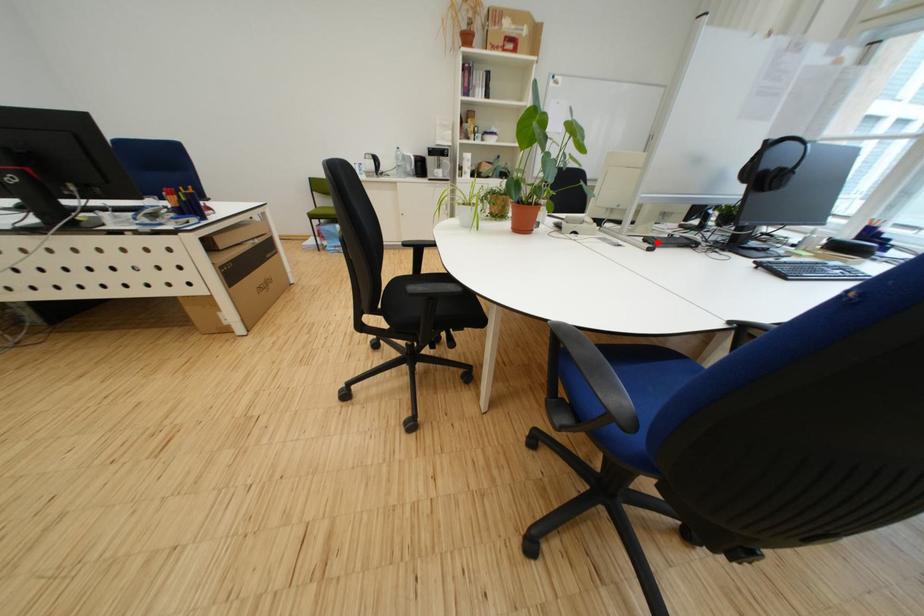
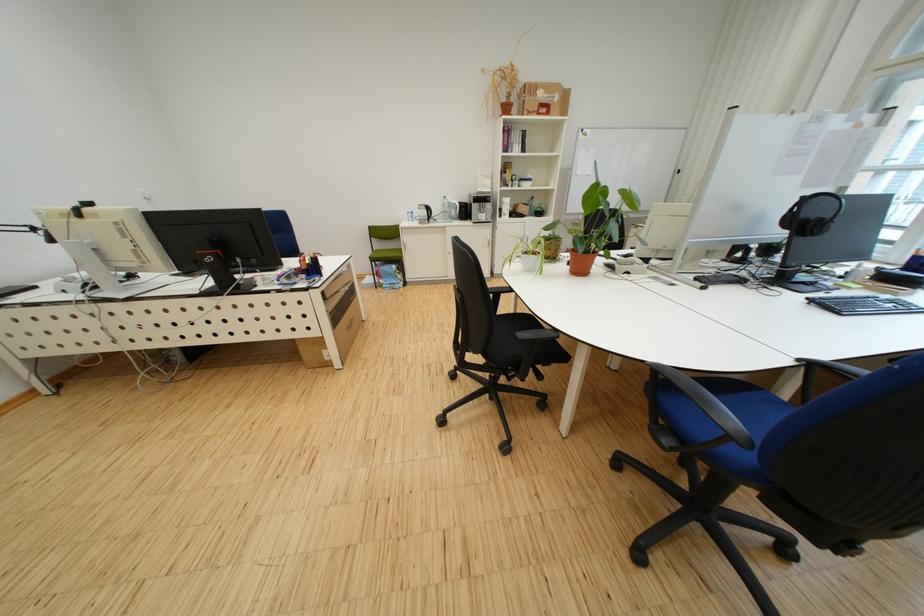
Locate, in the second image, the point that corresponds to the highlighted location in the first image.

(708, 281)